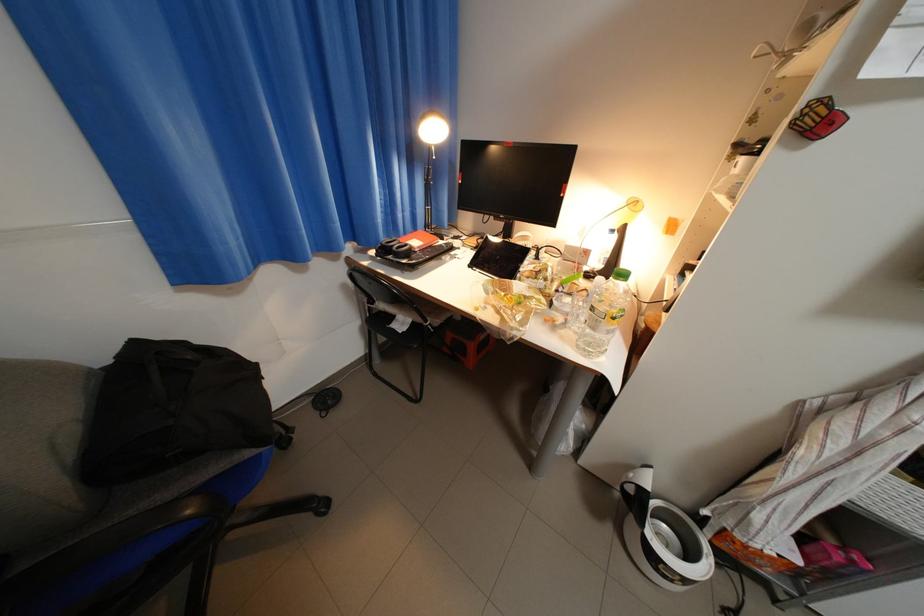
Identify the location of black chair armrest. (x=391, y=323).